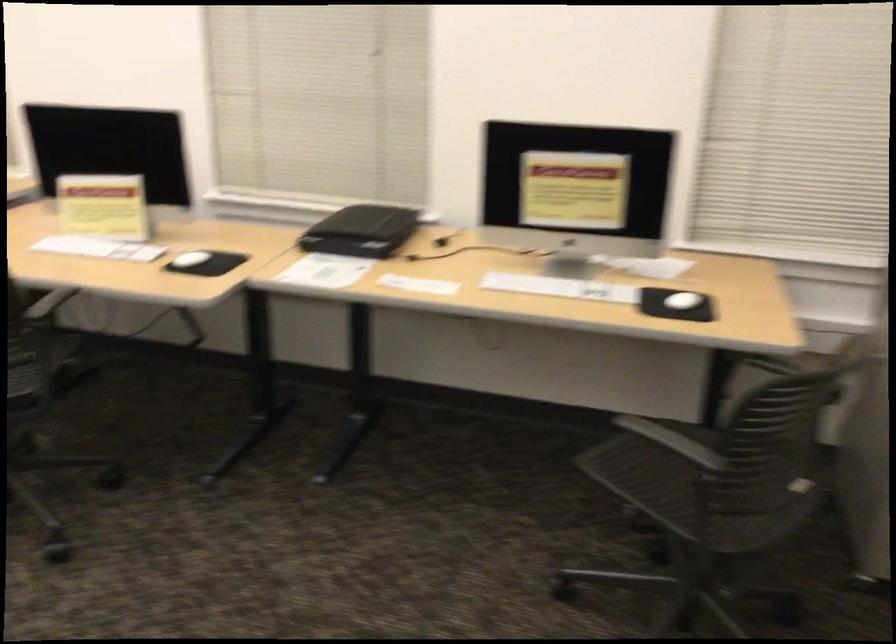
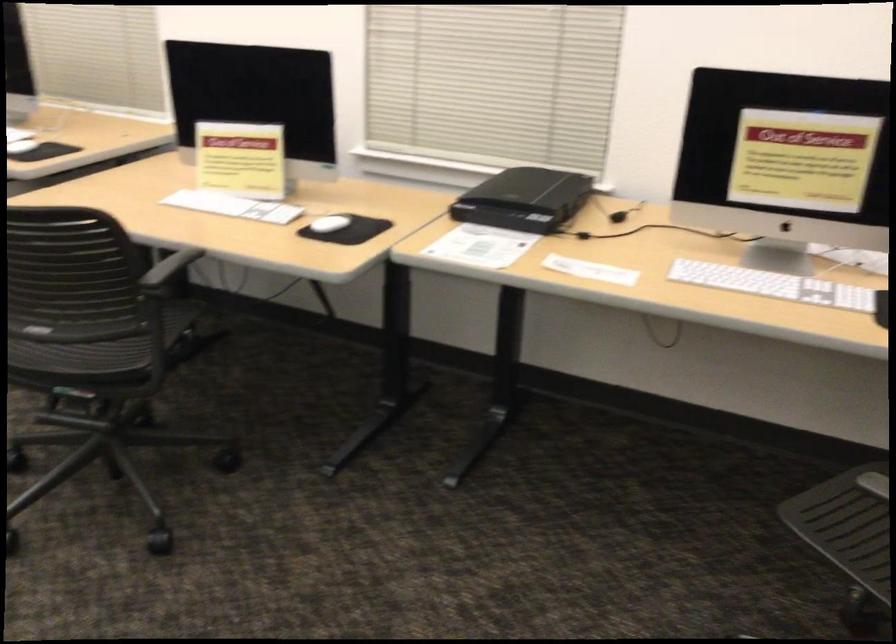
Question: The images are taken continuously from a first-person perspective. In which direction are you moving?

Choices:
 (A) Left
 (B) Right
 (C) Forward
 (D) Backward

Answer: (C)